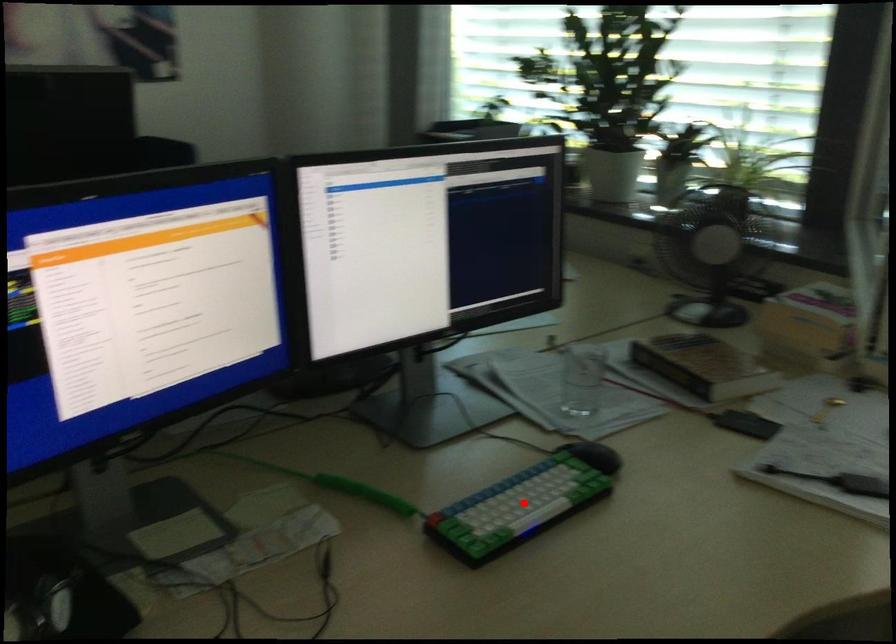
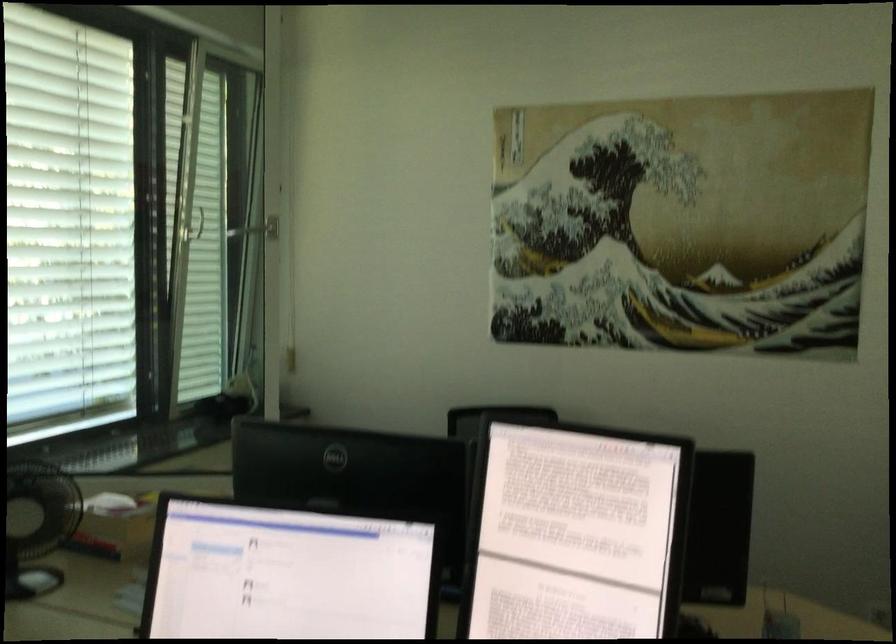
Question: I am providing you with two images of the same scene from different viewpoints. A red point is marked on the first image. At the location where the point appears in image 1, is it still visible in image 2?

Choices:
 (A) Yes
 (B) No

Answer: (B)